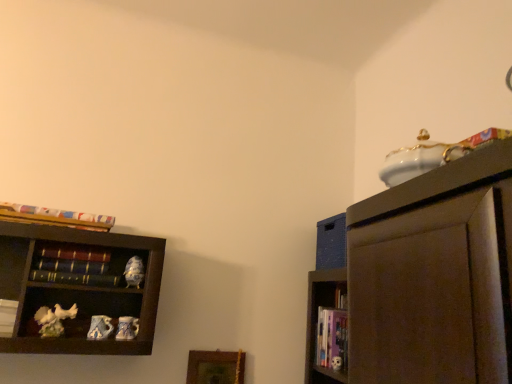
Question: Is hardcover books at left, marked as the 2th book in a top-to-bottom arrangement, positioned beyond the bounds of hardcover book at left, which is counted as the third book, starting from the bottom?

Choices:
 (A) no
 (B) yes

Answer: (B)

Question: Is hardcover books at left, which ranks as the third book in right-to-left order, shorter than hardcover book at left, arranged as the 2th book when viewed from the right?

Choices:
 (A) yes
 (B) no

Answer: (B)

Question: Is hardcover books at left, marked as the 2th book in a top-to-bottom arrangement, beside hardcover book at left, the third book from the top?

Choices:
 (A) yes
 (B) no

Answer: (A)

Question: Is hardcover books at left, which ranks as the third book in right-to-left order, to the left of hardcover book at left, the third book from the top, from the viewer's perspective?

Choices:
 (A) yes
 (B) no

Answer: (A)

Question: Does hardcover books at left, which appears as the third book when viewed from the left, have a larger size compared to hardcover book at left, which ranks as the 4th book in left-to-right order?

Choices:
 (A) no
 (B) yes

Answer: (B)

Question: Is the position of hardcover books at left, marked as the 2th book in a top-to-bottom arrangement, less distant than that of hardcover book at left, which ranks as the 4th book in left-to-right order?

Choices:
 (A) no
 (B) yes

Answer: (A)

Question: Are wooden picture frame at lower center and hardcover book at left, arranged as the 2th book when viewed from the right, located far from each other?

Choices:
 (A) yes
 (B) no

Answer: (B)

Question: Is wooden picture frame at lower center with hardcover book at left, which ranks as the 4th book in left-to-right order?

Choices:
 (A) no
 (B) yes

Answer: (A)

Question: Is wooden picture frame at lower center thinner than hardcover book at left, which is counted as the third book, starting from the bottom?

Choices:
 (A) no
 (B) yes

Answer: (B)

Question: Can you confirm if wooden picture frame at lower center is shorter than hardcover book at left, which ranks as the 4th book in left-to-right order?

Choices:
 (A) no
 (B) yes

Answer: (A)

Question: Can you confirm if wooden picture frame at lower center is wider than hardcover book at left, which ranks as the 4th book in left-to-right order?

Choices:
 (A) no
 (B) yes

Answer: (A)

Question: Can you confirm if wooden picture frame at lower center is positioned to the left of hardcover book at left, which ranks as the 4th book in left-to-right order?

Choices:
 (A) no
 (B) yes

Answer: (A)

Question: Does multicolored paper at upper left, positioned as the 5th book in bottom-to-top order, appear on the right side of white matte book at left, the second book in the bottom-to-top sequence?

Choices:
 (A) no
 (B) yes

Answer: (B)